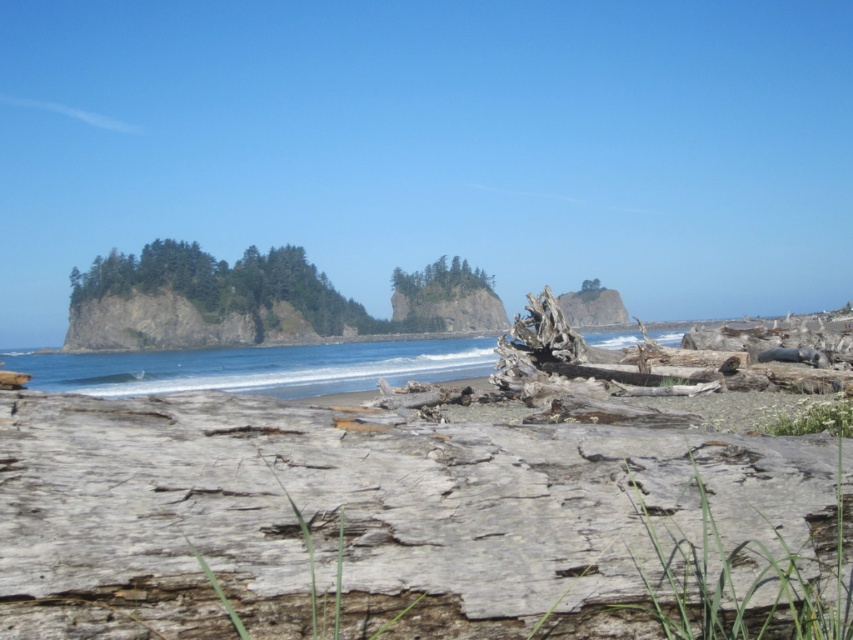
Can you confirm if green rough rock island at left is taller than green textured trees at center?

Yes, green rough rock island at left is taller than green textured trees at center.

This screenshot has width=853, height=640. In order to click on green rough rock island at left in this screenshot , I will do `click(206, 300)`.